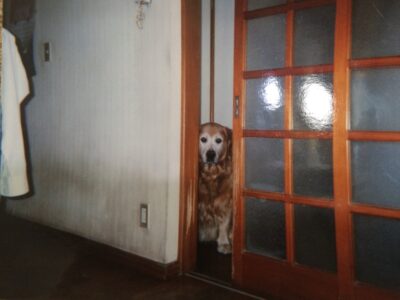
Identify the location of reflection of light through or behind door. This screenshot has width=400, height=300. (315, 102), (272, 100).